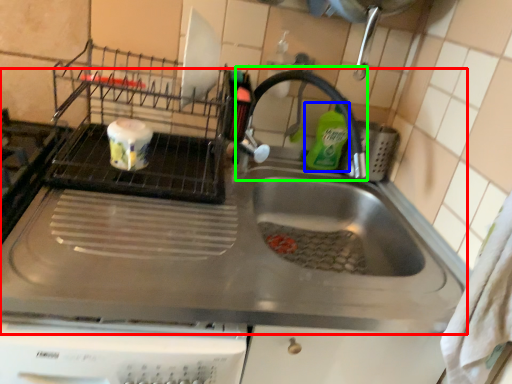
Question: Which object is positioned closest to sink (highlighted by a red box)? Select from cleaning product (highlighted by a blue box) and faucet (highlighted by a green box).

Choices:
 (A) cleaning product
 (B) faucet

Answer: (B)